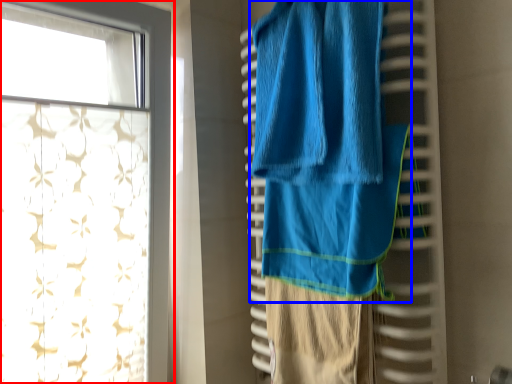
Question: Among these objects, which one is farthest to the camera, curtain (highlighted by a red box) or towel (highlighted by a blue box)?

Choices:
 (A) curtain
 (B) towel

Answer: (A)